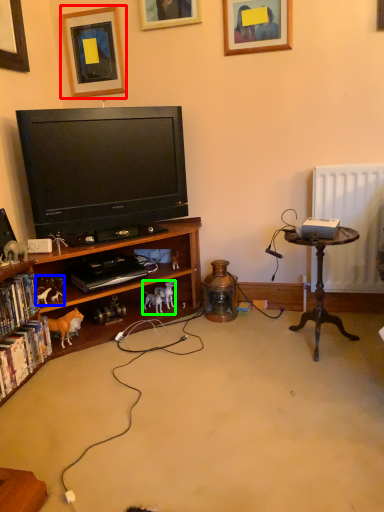
Question: Based on their relative distances, which object is nearer to picture frame (highlighted by a red box)? Choose from toy (highlighted by a blue box) and toy (highlighted by a green box).

Choices:
 (A) toy
 (B) toy

Answer: (A)